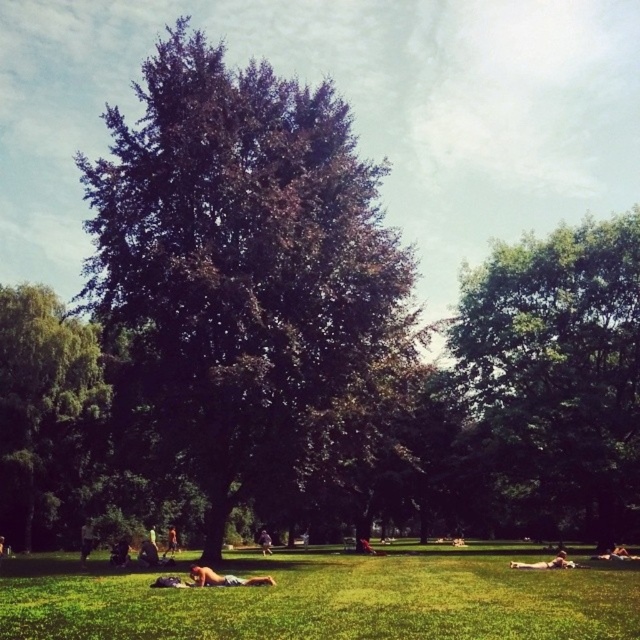
You are planning to set up a picnic blanket in the park. The dark green leafy tree at center provides shade, and you have a leather jacket at center nearby. Considering their sizes, which object would cast a larger shadow area on the ground?

The dark green leafy tree at center has a larger size compared to the leather jacket at center, so it would cast a larger shadow area on the ground.

From the picture: You are a photographer setting up a tripod in the park. You need to position it between the light brown fabric shirt at lower left and the brown leather jacket at lower left. Which side of the path should you place the tripod to ensure it doesn not block the view of either person?

The light brown fabric shirt at lower left might be wider than brown leather jacket at lower left, so placing the tripod closer to the brown leather jacket at lower left side would minimize the chance of blocking either person.

You are standing in the park and want to walk from the point closer to you to the point further away. Which path would you take between the two points, point (168, 256) and point (358, 547)?

The path from point (168, 256) to point (358, 547) requires moving away from the viewer since point (168, 256) is closer to you than point (358, 547).